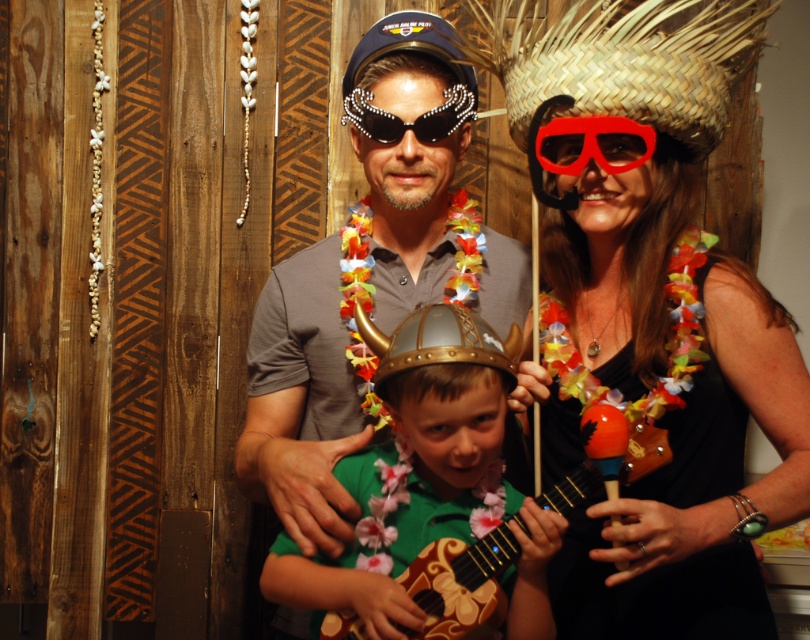
Question: Is wooden maraca at right positioned behind pearl-studded sunglasses at center?

Choices:
 (A) yes
 (B) no

Answer: (B)

Question: Can you confirm if metallic green guitar at center is positioned below wooden acoustic guitar at center?

Choices:
 (A) yes
 (B) no

Answer: (B)

Question: Among these points, which one is farthest from the camera?

Choices:
 (A) tap(591, 376)
 (B) tap(463, 330)

Answer: (A)

Question: Among these objects, which one is nearest to the camera?

Choices:
 (A) matte gray shirt at center
 (B) pearl-studded sunglasses at center
 (C) wooden acoustic guitar at center
 (D) wooden maraca at right

Answer: (C)

Question: Which object is the farthest from the wooden maraca at right?

Choices:
 (A) matte gray shirt at center
 (B) pearl-studded sunglasses at center
 (C) wooden acoustic guitar at center

Answer: (B)

Question: Can you confirm if matte gray shirt at center is smaller than wooden acoustic guitar at center?

Choices:
 (A) no
 (B) yes

Answer: (A)